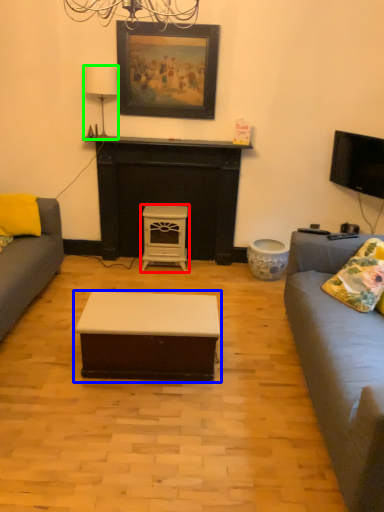
Question: Which is farther away from stool (highlighted by a red box)? coffee table (highlighted by a blue box) or lamp (highlighted by a green box)?

Choices:
 (A) coffee table
 (B) lamp

Answer: (A)